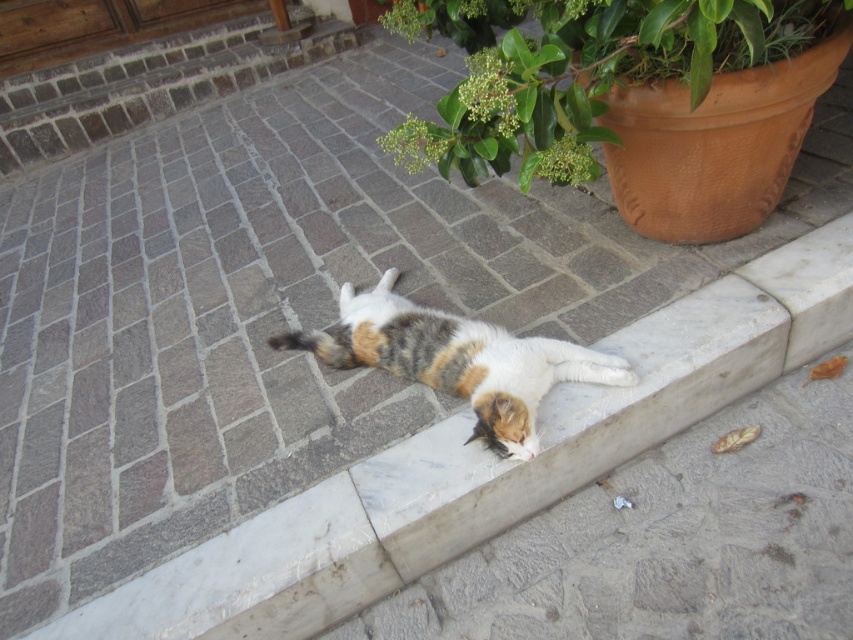
Which is more to the right, green leafy plant at upper center or calico fur cat at center?

Positioned to the right is green leafy plant at upper center.

Is green leafy plant at upper center shorter than calico fur cat at center?

No.

Locate an element on the screen. The image size is (853, 640). green leafy plant at upper center is located at coordinates (573, 74).

Find the location of a particular element. green leafy plant at upper center is located at coordinates (573, 74).